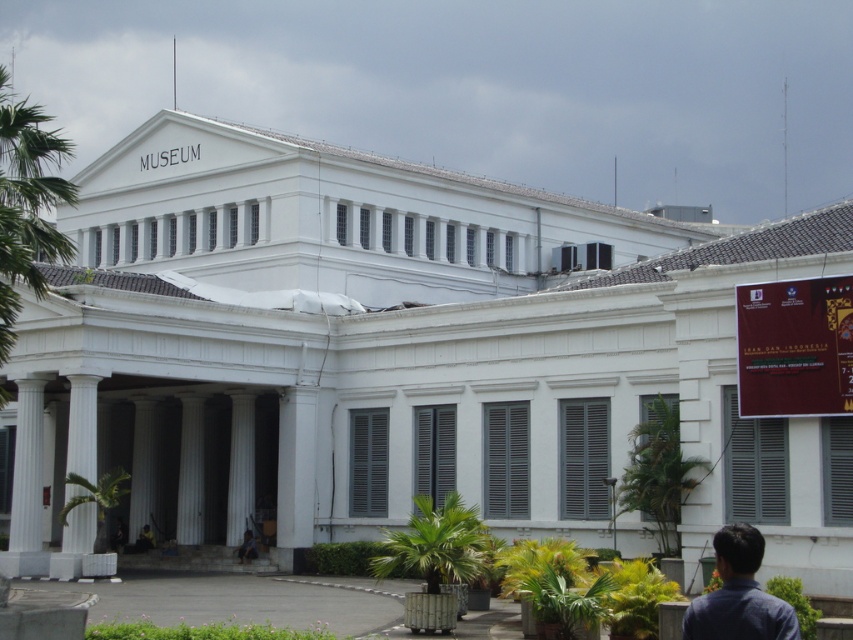
Question: Can you confirm if green leafy palm tree at left is bigger than white marble column at left?

Choices:
 (A) no
 (B) yes

Answer: (B)

Question: Considering the relative positions of green leafy palm tree at center and white marble column at center in the image provided, where is green leafy palm tree at center located with respect to white marble column at center?

Choices:
 (A) below
 (B) above

Answer: (B)

Question: Which point appears farthest from the camera in this image?

Choices:
 (A) (9, 122)
 (B) (73, 515)
 (C) (74, 502)
 (D) (248, 396)

Answer: (D)

Question: Which point is farther to the camera?

Choices:
 (A) (241, 448)
 (B) (78, 493)

Answer: (A)

Question: Is the position of white marble column at left more distant than that of green leafy palm tree at lower left?

Choices:
 (A) yes
 (B) no

Answer: (A)

Question: Which of the following is the farthest from the observer?

Choices:
 (A) (758, 540)
 (B) (248, 394)
 (C) (57, 154)
 (D) (128, 490)

Answer: (D)